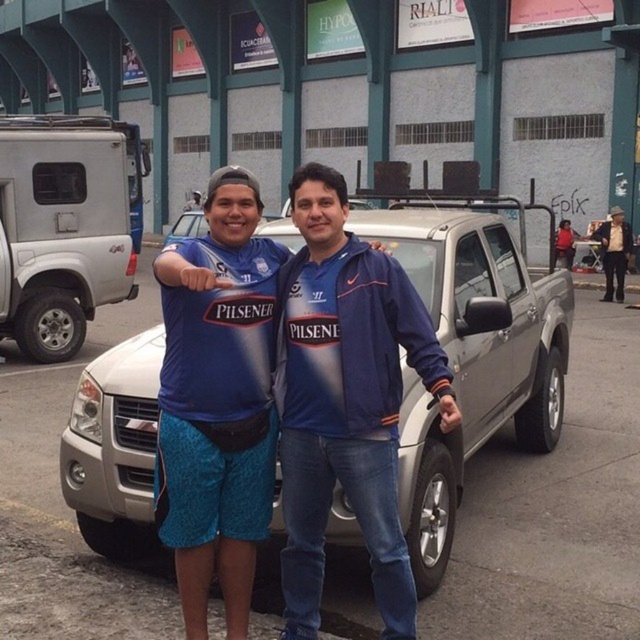
Question: Is brushed metal truck at center positioned before satin silver truck at center?

Choices:
 (A) no
 (B) yes

Answer: (A)

Question: Is satin silver truck at center thinner than blue fabric jacket at center?

Choices:
 (A) no
 (B) yes

Answer: (A)

Question: Does blue fabric jacket at center appear on the right side of silver metallic suv at left?

Choices:
 (A) yes
 (B) no

Answer: (A)

Question: Which object is positioned closest to the brushed metal truck at center?

Choices:
 (A) silver metallic suv at left
 (B) satin silver truck at center
 (C) blue fabric jacket at center

Answer: (B)

Question: Estimate the real-world distances between objects in this image. Which object is farther from the satin silver truck at center?

Choices:
 (A) brushed metal truck at center
 (B) blue fabric jacket at center
 (C) silver metallic suv at left

Answer: (A)

Question: Which of the following is the closest to the observer?

Choices:
 (A) (348, 58)
 (B) (461, 300)
 (C) (84, 294)

Answer: (B)